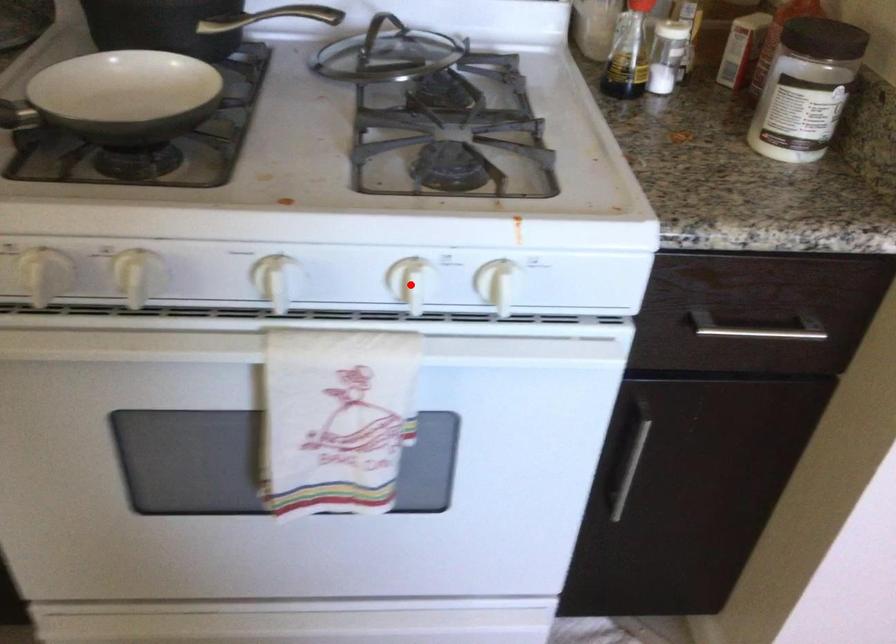
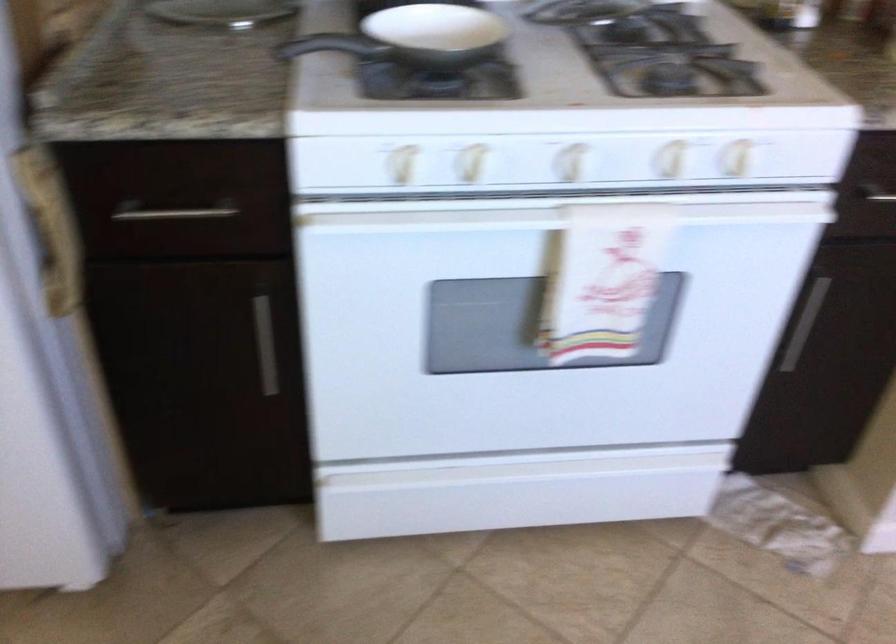
Find the pixel in the second image that matches the highlighted location in the first image.

(670, 158)